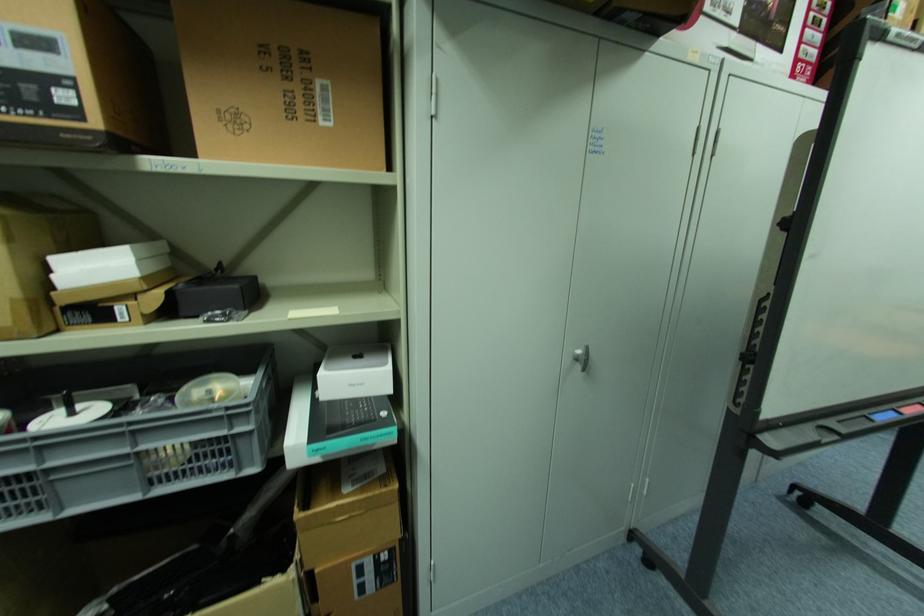
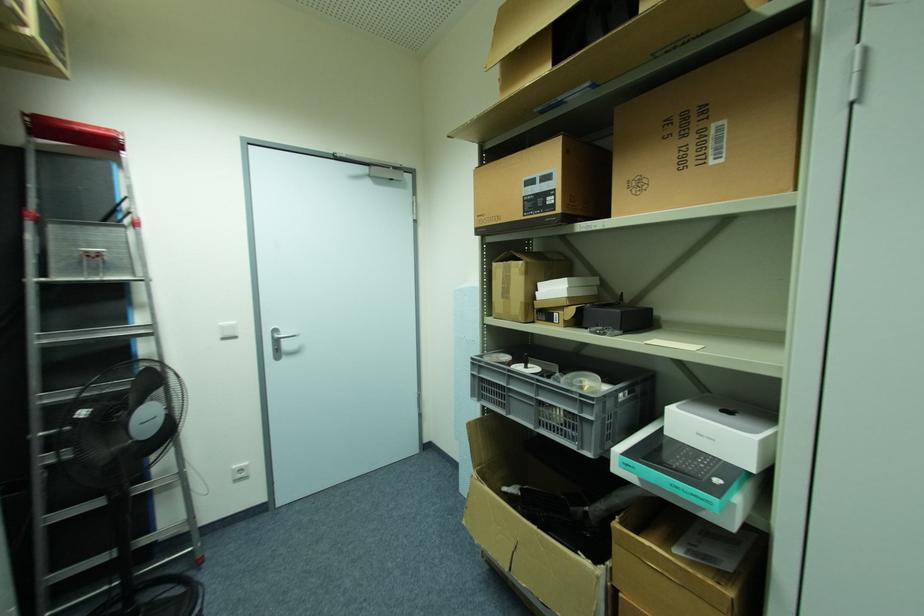
Question: The camera is either moving clockwise (left) or counter-clockwise (right) around the object. The first image is from the beginning of the video and the second image is from the end. Is the camera moving left or right when shooting the video?

Choices:
 (A) Left
 (B) Right

Answer: (B)